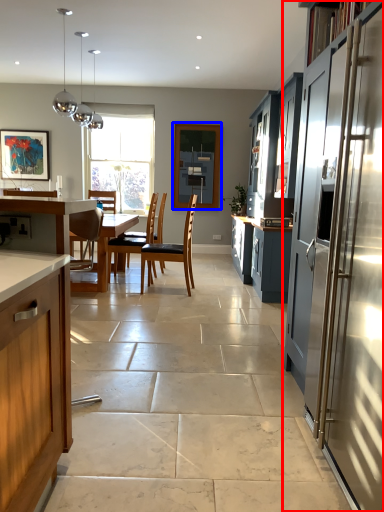
Question: Which of the following is the farthest to the observer, cabinetry (highlighted by a red box) or window screen (highlighted by a blue box)?

Choices:
 (A) cabinetry
 (B) window screen

Answer: (B)